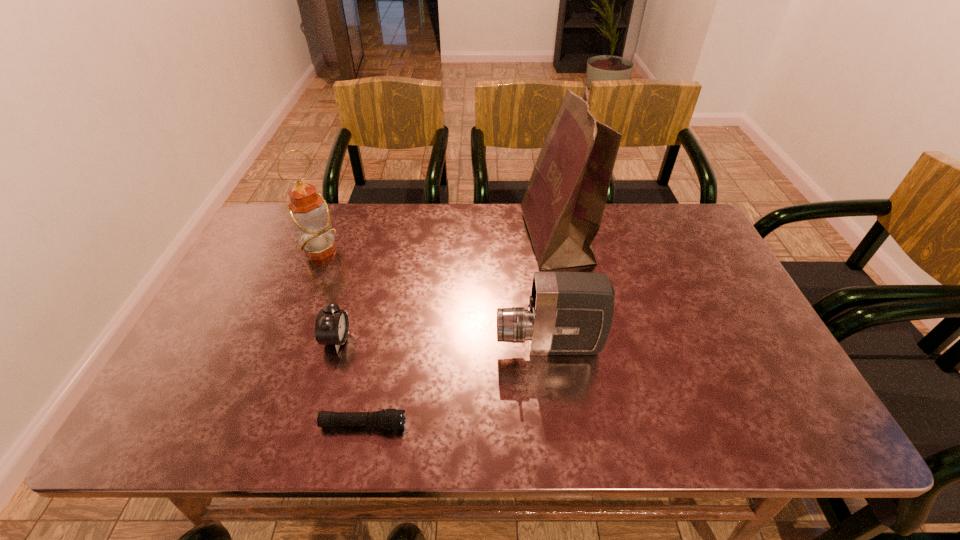
Find the location of a particular element. grocery bag is located at coordinates (563, 206).

Identify the location of oil lamp. click(x=309, y=212).

Where is `the leftmost object`? the leftmost object is located at coordinates (309, 212).

You are a GUI agent. You are given a task and a screenshot of the screen. Output one action in this format:
    pyautogui.click(x=<x>, y=<y>)
    Task: Click on the third tallest object
    This screenshot has height=540, width=960.
    Given the screenshot: What is the action you would take?
    pyautogui.click(x=569, y=313)

I want to click on alarm clock, so click(332, 324).

At what (x,y) coordinates should I click in order to perform the action: click on the shortest object. Please return your answer as a coordinate pair (x, y). Looking at the image, I should click on (387, 419).

I want to click on flashlight, so click(x=387, y=419).

The height and width of the screenshot is (540, 960). In order to click on free spot located on the front-facing side of the tallest object in this screenshot , I will do `click(507, 238)`.

The image size is (960, 540). I want to click on free space located 0.130m on the front-facing side of the tallest object, so click(x=482, y=238).

Find the location of a particular element. This screenshot has height=540, width=960. vacant region located 0.140m on the front-facing side of the tallest object is located at coordinates (479, 238).